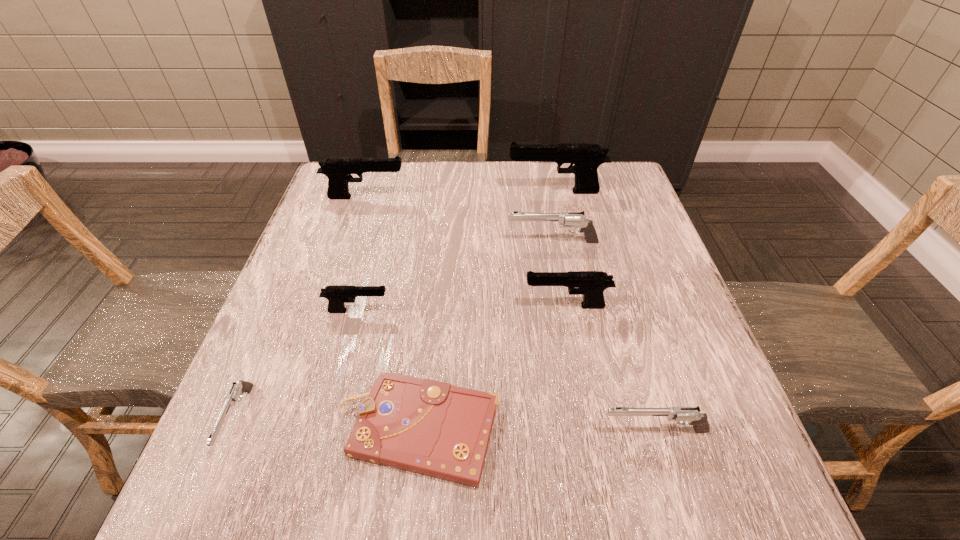
Where is `empty space between the smallest black pistol and the third farthest pistol`? The image size is (960, 540). empty space between the smallest black pistol and the third farthest pistol is located at coordinates (455, 276).

This screenshot has height=540, width=960. I want to click on free point between the leftmost silver pistol and the third smallest black pistol, so click(x=301, y=308).

Identify the location of free space between the notebook and the second smallest silver pistol. (537, 429).

Where is `empty space that is in between the notebook and the fifth nearest pistol`? This screenshot has width=960, height=540. empty space that is in between the notebook and the fifth nearest pistol is located at coordinates tap(485, 335).

Locate an element on the screen. The image size is (960, 540). vacant area that lies between the notebook and the smallest black pistol is located at coordinates (388, 370).

Identify which object is located as the fourth nearest to the second smallest silver pistol. Please provide its 2D coordinates. Your answer should be formatted as a tuple, i.e. [(x, y)], where the tuple contains the x and y coordinates of a point satisfying the conditions above.

[(565, 219)]

I want to click on object identified as the second closest to the second smallest silver pistol, so click(x=591, y=284).

Select which pistol is the fifth closest to the smallest silver pistol. Please provide its 2D coordinates. Your answer should be formatted as a tuple, i.e. [(x, y)], where the tuple contains the x and y coordinates of a point satisfying the conditions above.

[(682, 415)]

Locate an element on the screen. Image resolution: width=960 pixels, height=540 pixels. the closest pistol to the tallest object is located at coordinates (565, 219).

Identify which black pistol is located as the second nearest to the brown notebook. Please provide its 2D coordinates. Your answer should be formatted as a tuple, i.e. [(x, y)], where the tuple contains the x and y coordinates of a point satisfying the conditions above.

[(591, 284)]